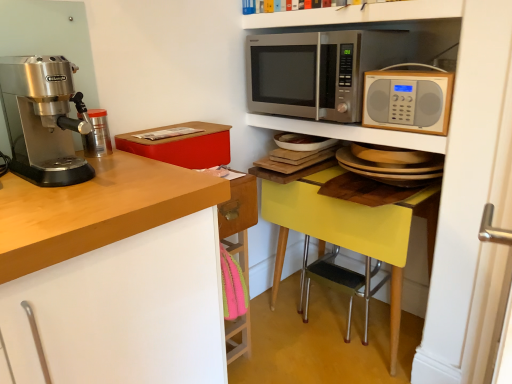
Question: From a real-world perspective, relative to matte red box at upper left, is metallic silver microwave at upper center, the second shelf when ordered from top to bottom, vertically above or below?

Choices:
 (A) above
 (B) below

Answer: (A)

Question: Based on their positions, is metallic silver microwave at upper center, the first shelf from the bottom, located to the left or right of matte red box at upper left?

Choices:
 (A) left
 (B) right

Answer: (B)

Question: Considering the real-world distances, which object is farthest from the stainless steel microwave at upper center, arranged as the 2th microwave oven when viewed from the front?

Choices:
 (A) metallic silver microwave at upper center, the first shelf from the bottom
 (B) matte red box at upper left
 (C) silver metallic microwave at upper right, the second microwave oven when ordered from back to front
 (D) pink fabric at lower left
 (E) yellow glossy table at lower right

Answer: (D)

Question: Estimate the real-world distances between objects in this image. Which object is farther from the white glossy shelf at upper center, marked as the 2th shelf in a bottom-to-top arrangement?

Choices:
 (A) metallic silver microwave at upper center, the second shelf when ordered from top to bottom
 (B) polished stainless steel espresso machine at left
 (C) metallic silver canister at left
 (D) stainless steel microwave at upper center, arranged as the 2th microwave oven when viewed from the front
 (E) matte red box at upper left

Answer: (B)